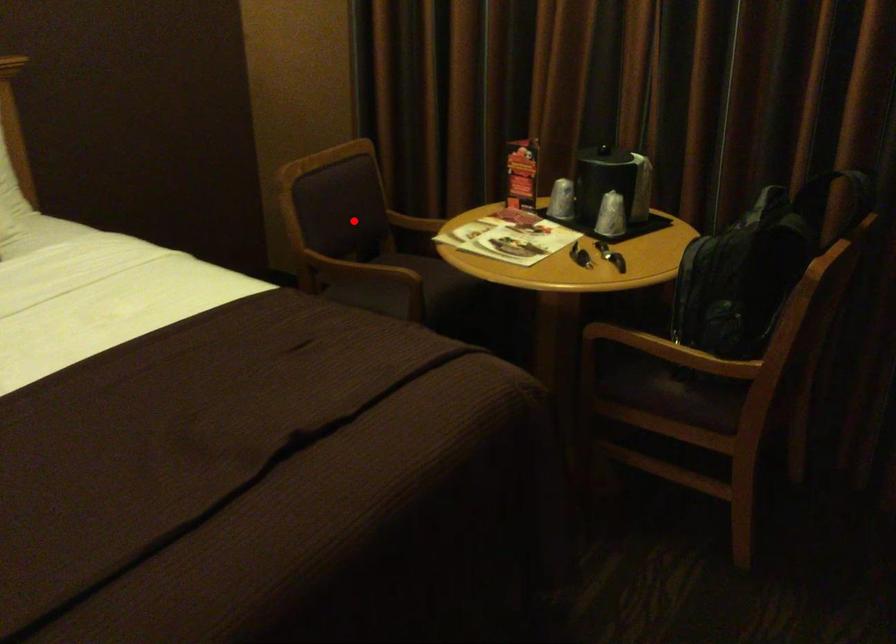
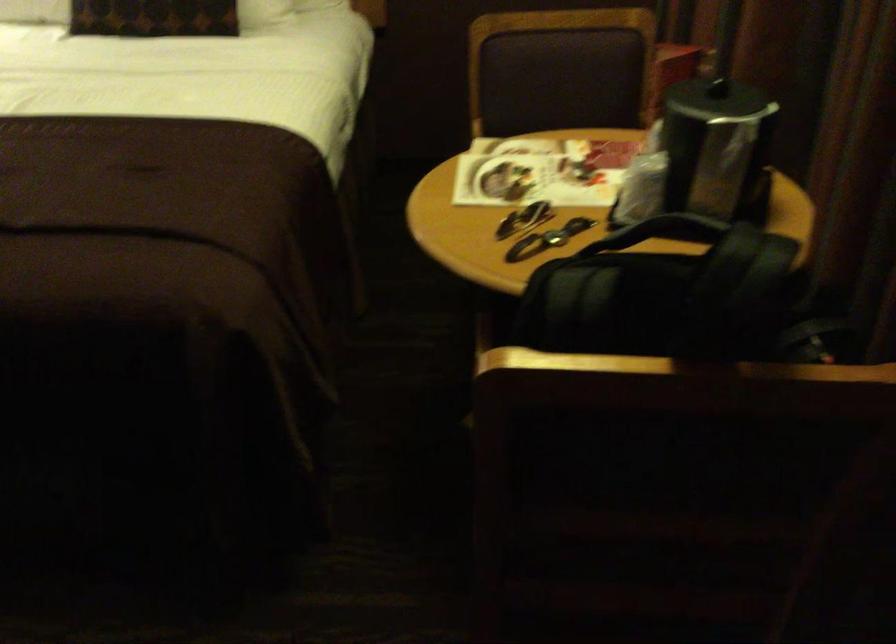
Find the pixel in the second image that matches the highlighted location in the first image.

(553, 113)